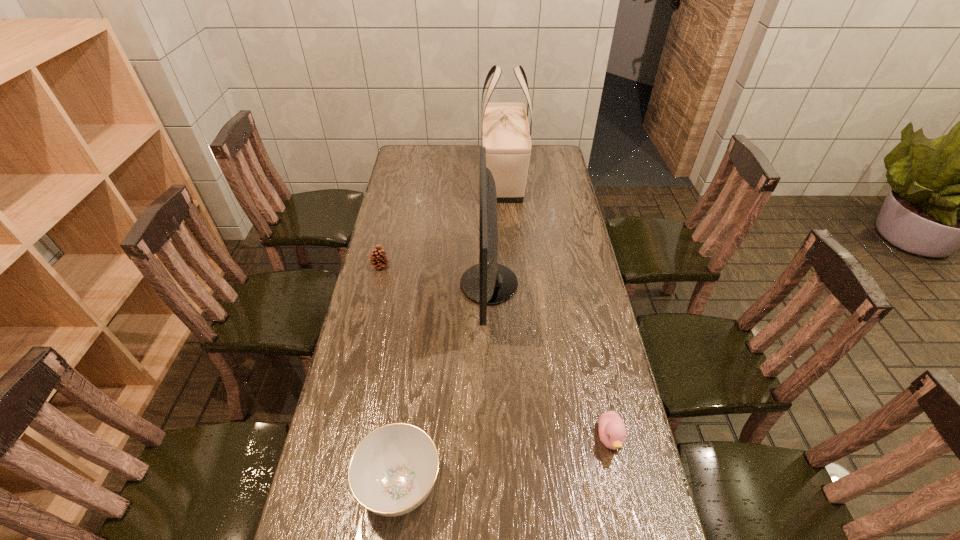
Where is `free region located 0.070m on the back of the second object from left to right`? free region located 0.070m on the back of the second object from left to right is located at coordinates (408, 419).

The width and height of the screenshot is (960, 540). I want to click on free space located 0.330m on the back of the leftmost object, so click(x=394, y=208).

In order to click on free spot located 0.170m on the front-facing side of the rightmost object in this screenshot , I will do `click(631, 534)`.

Where is `object located at the far edge`? The width and height of the screenshot is (960, 540). object located at the far edge is located at coordinates (505, 129).

The width and height of the screenshot is (960, 540). What are the coordinates of `chinaware located at the left edge` in the screenshot? It's located at (392, 471).

At what (x,y) coordinates should I click in order to perform the action: click on pinecone present at the left edge. Please return your answer as a coordinate pair (x, y). This screenshot has width=960, height=540. Looking at the image, I should click on (378, 259).

Identify the location of object that is positioned at the right edge. This screenshot has width=960, height=540. (612, 431).

Locate an element on the screen. This screenshot has height=540, width=960. free space at the far edge is located at coordinates (474, 147).

This screenshot has width=960, height=540. In the image, there is a desktop. What are the coordinates of `vacant space at the left edge` in the screenshot? It's located at (402, 316).

At what (x,y) coordinates should I click in order to perform the action: click on vacant region at the right edge of the desktop. Please return your answer as a coordinate pair (x, y). Image resolution: width=960 pixels, height=540 pixels. Looking at the image, I should click on (588, 276).